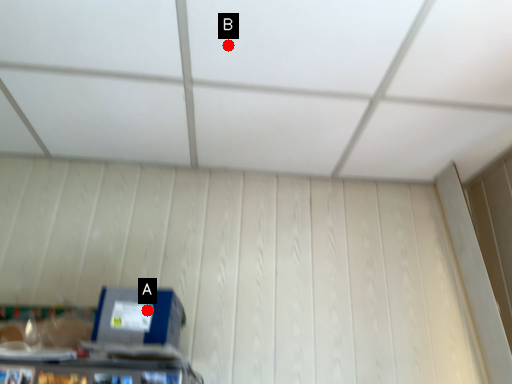
Question: Two points are circled on the image, labeled by A and B beside each circle. Among these points, which one is nearest to the camera?

Choices:
 (A) A is closer
 (B) B is closer

Answer: (A)